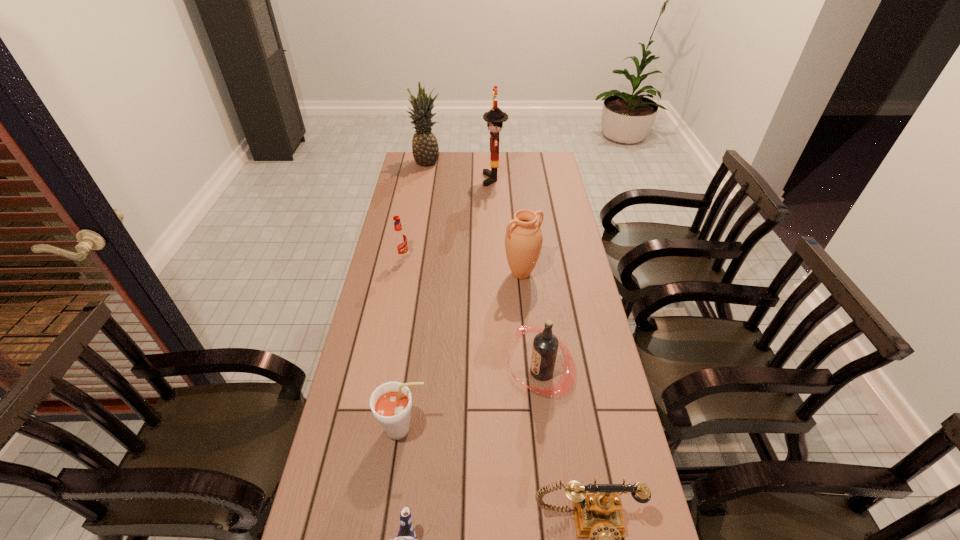
Find the location of a particular element. pineapple located in the far edge section of the desktop is located at coordinates (425, 150).

Where is `pineapple situated at the left edge`? The image size is (960, 540). pineapple situated at the left edge is located at coordinates (425, 150).

You are a GUI agent. You are given a task and a screenshot of the screen. Output one action in this format:
    pyautogui.click(x=<x>, y=<y>)
    Task: Click on the object situated at the right edge
    The image size is (960, 540).
    Given the screenshot: What is the action you would take?
    pyautogui.click(x=545, y=345)

The image size is (960, 540). Find the location of `object at the far left corner`. object at the far left corner is located at coordinates (425, 150).

At what (x,y) coordinates should I click in order to perform the action: click on vacant space at the left edge. Please return your answer as a coordinate pair (x, y). The width and height of the screenshot is (960, 540). Looking at the image, I should click on (387, 261).

Locate an element on the screen. The width and height of the screenshot is (960, 540). free region at the right edge of the desktop is located at coordinates (567, 205).

In the image, there is a desktop. Where is `vacant space at the far right corner`? vacant space at the far right corner is located at coordinates (537, 161).

Where is `free space between the leftmost root beer and the nutcracker`? free space between the leftmost root beer and the nutcracker is located at coordinates (448, 218).

Where is `vacant area that lies between the nutcracker and the second tallest object`? The image size is (960, 540). vacant area that lies between the nutcracker and the second tallest object is located at coordinates (461, 171).

Identify the location of free space between the farthest root beer and the fourth nearest object. (471, 315).